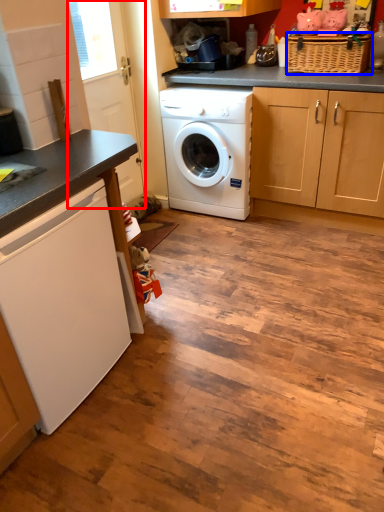
Question: Which object appears closest to the camera in this image, screen door (highlighted by a red box) or basket (highlighted by a blue box)?

Choices:
 (A) screen door
 (B) basket

Answer: (A)